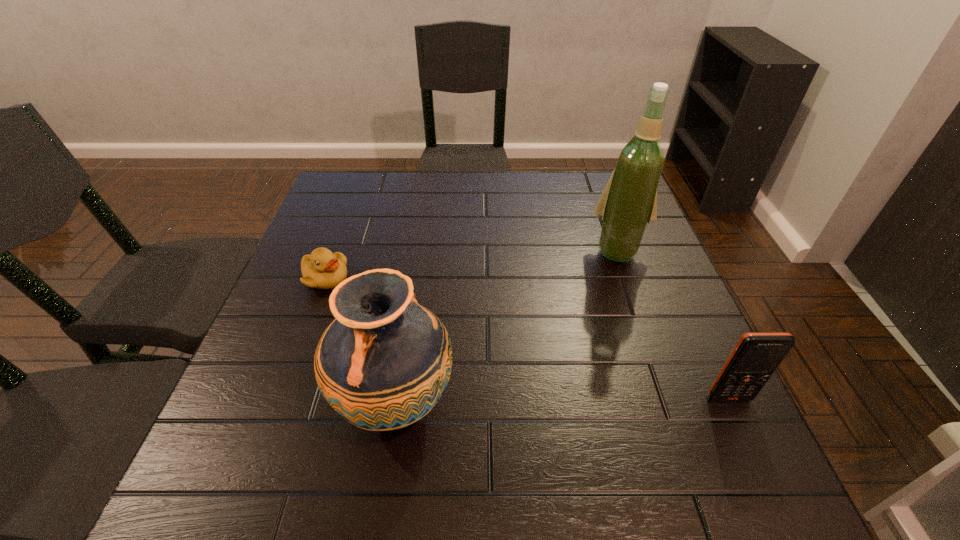
The image size is (960, 540). I want to click on pottery, so click(383, 363).

Locate an element on the screen. the second object from left to right is located at coordinates (383, 363).

The image size is (960, 540). I want to click on cellular telephone, so click(x=756, y=356).

The height and width of the screenshot is (540, 960). What are the coordinates of `the tallest object` in the screenshot? It's located at (629, 201).

Where is `the leftmost object`? The image size is (960, 540). the leftmost object is located at coordinates (322, 269).

Where is `the shortest object`? Image resolution: width=960 pixels, height=540 pixels. the shortest object is located at coordinates (322, 269).

Where is `free region located 0.300m on the right of the second object from left to right`? This screenshot has width=960, height=540. free region located 0.300m on the right of the second object from left to right is located at coordinates (618, 402).

The width and height of the screenshot is (960, 540). I want to click on vacant position located 0.330m on the front-facing side of the tallest object, so click(597, 374).

Identify the location of free space located on the front-facing side of the tallest object. The width and height of the screenshot is (960, 540). (594, 392).

The height and width of the screenshot is (540, 960). Find the location of `free space located on the front-facing side of the tallest object`. free space located on the front-facing side of the tallest object is located at coordinates (598, 370).